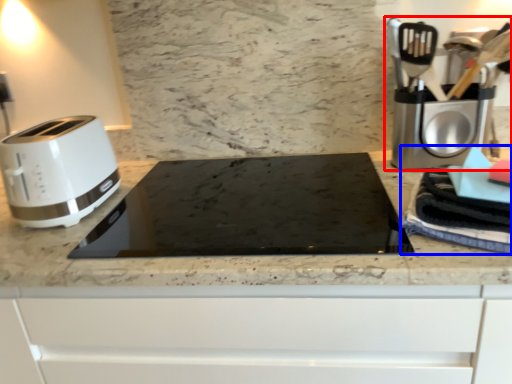
Question: Which of the following is the closest to the observer, coffee machine (highlighted by a red box) or blanket (highlighted by a blue box)?

Choices:
 (A) coffee machine
 (B) blanket

Answer: (B)